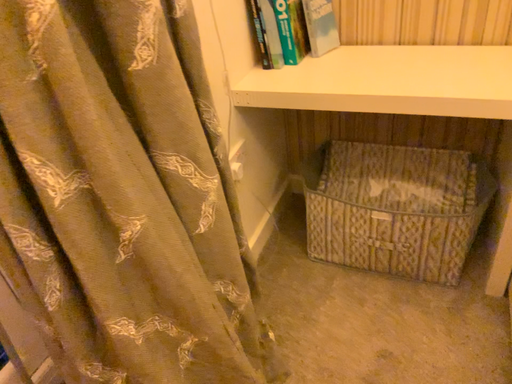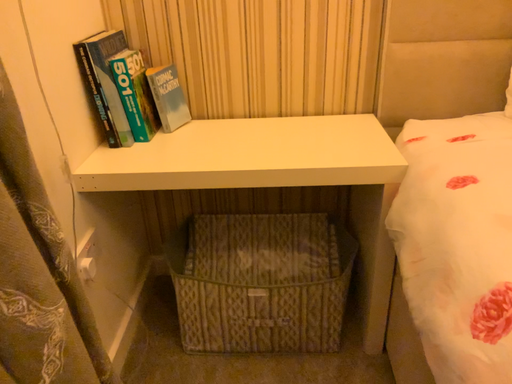
Question: How did the camera likely rotate when shooting the video?

Choices:
 (A) rotated upward
 (B) rotated downward

Answer: (A)